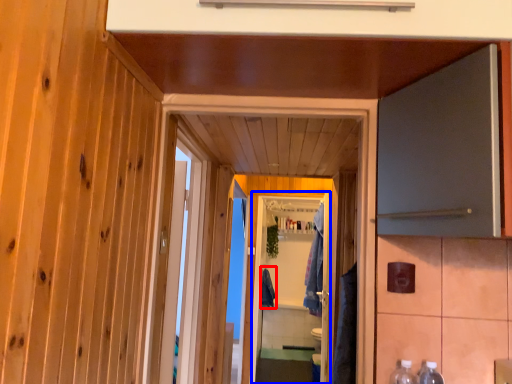
Question: Which object is further to the camera taking this photo, robe (highlighted by a red box) or screen door (highlighted by a blue box)?

Choices:
 (A) robe
 (B) screen door

Answer: (A)